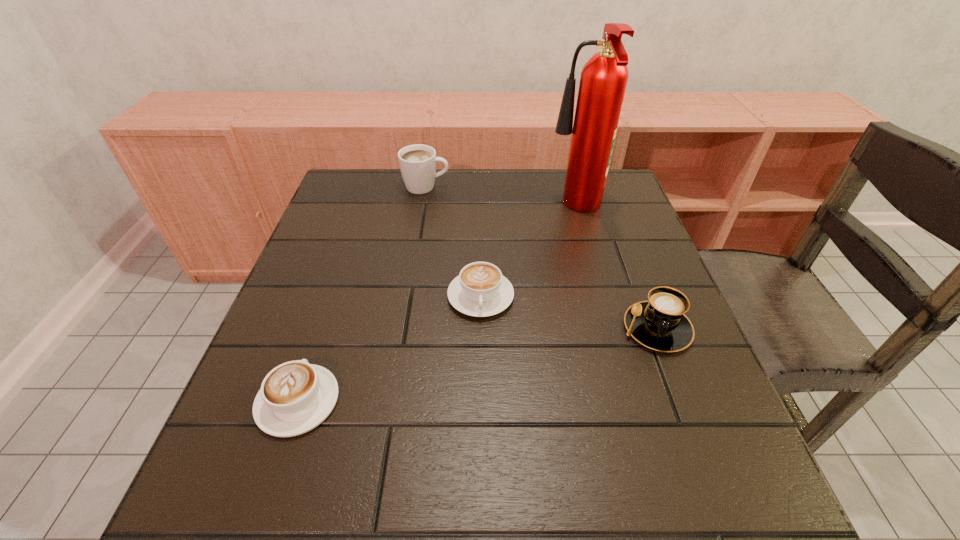
Identify which cappuccino is the third nearest to the fourth object from right to left. Please provide its 2D coordinates. Your answer should be formatted as a tuple, i.e. [(x, y)], where the tuple contains the x and y coordinates of a point satisfying the conditions above.

[(295, 397)]

Point out which cappuccino is positioned as the nearest to the third object from left to right. Please provide its 2D coordinates. Your answer should be formatted as a tuple, i.e. [(x, y)], where the tuple contains the x and y coordinates of a point satisfying the conditions above.

[(295, 397)]

This screenshot has width=960, height=540. What are the coordinates of `vacant region that satisfies the following two spatial constraints: 1. with the handle on the side of the second object from left to right; 2. on the left side of the third tallest object` in the screenshot? It's located at (402, 328).

The height and width of the screenshot is (540, 960). I want to click on vacant space that satisfies the following two spatial constraints: 1. with the handle on the side of the third tallest object; 2. on the left side of the third cappuccino from right to left, so click(402, 328).

You are a GUI agent. You are given a task and a screenshot of the screen. Output one action in this format:
    pyautogui.click(x=<x>, y=<y>)
    Task: Click on the vacant space that satisfies the following two spatial constraints: 1. with the handle on the right side of the rightmost cappuccino; 2. on the right side of the leftmost object
    
    Given the screenshot: What is the action you would take?
    pyautogui.click(x=323, y=328)

Find the location of a particular element. The image size is (960, 540). vacant space that satisfies the following two spatial constraints: 1. at the nozzle of the third shortest object; 2. on the left side of the tallest object is located at coordinates (610, 328).

The image size is (960, 540). Find the location of `vacant region that satisfies the following two spatial constraints: 1. at the nozzle of the third shortest cappuccino; 2. on the left side of the tallest object`. vacant region that satisfies the following two spatial constraints: 1. at the nozzle of the third shortest cappuccino; 2. on the left side of the tallest object is located at coordinates (610, 328).